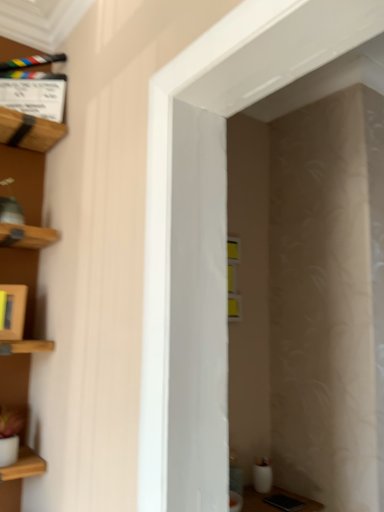
What do you see at coordinates (14, 311) in the screenshot? The width and height of the screenshot is (384, 512). I see `wooden frame at left` at bounding box center [14, 311].

You are a GUI agent. You are given a task and a screenshot of the screen. Output one action in this format:
    pyautogui.click(x=<x>, y=<y>)
    Task: Click on the wooden frame at left
    The image size is (384, 512).
    Given the screenshot: What is the action you would take?
    pyautogui.click(x=14, y=311)

Describe the element at coordinates (198, 314) in the screenshot. I see `white glossy door at center` at that location.

You are a GUI agent. You are given a task and a screenshot of the screen. Output one action in this format:
    pyautogui.click(x=<x>, y=<y>)
    Task: Click on the wooden frame at left
    
    Given the screenshot: What is the action you would take?
    pyautogui.click(x=14, y=311)

From the image's perspective, is wooden frame at left on top of wooden clapperboard at upper left?

No, from the image's perspective, wooden frame at left is not over wooden clapperboard at upper left.

Would you say wooden frame at left is inside or outside wooden clapperboard at upper left?

wooden frame at left is outside wooden clapperboard at upper left.

Does point (16, 298) lie in front of point (42, 126)?

Yes.

Is wooden frame at left further to the viewer compared to wooden clapperboard at upper left?

No, it is in front of wooden clapperboard at upper left.

Is wooden clapperboard at upper left bigger than white glossy door at center?

Incorrect, wooden clapperboard at upper left is not larger than white glossy door at center.

Is wooden clapperboard at upper left in contact with white glossy door at center?

wooden clapperboard at upper left and white glossy door at center are not in contact.

Which of these two, wooden clapperboard at upper left or white glossy door at center, is thinner?

With smaller width is wooden clapperboard at upper left.

Does point (218, 330) come closer to viewer compared to point (57, 54)?

Yes, it is.

Considering the relative sizes of white glossy door at center and wooden clapperboard at upper left in the image provided, is white glossy door at center smaller than wooden clapperboard at upper left?

Incorrect, white glossy door at center is not smaller in size than wooden clapperboard at upper left.

Could you tell me if white glossy door at center is turned towards wooden clapperboard at upper left?

No, white glossy door at center does not turn towards wooden clapperboard at upper left.

Is white glossy door at center in front of or behind wooden clapperboard at upper left in the image?

white glossy door at center is in front of wooden clapperboard at upper left.

Is wooden frame at left turned away from white glossy door at center?

No.

Where is `cabinet located on the left of white glossy door at center`? cabinet located on the left of white glossy door at center is located at coordinates (14, 311).

Consider the image. Considering the relative positions of wooden frame at left and white glossy door at center in the image provided, is wooden frame at left to the left or to the right of white glossy door at center?

wooden frame at left is to the left of white glossy door at center.

Looking at their sizes, would you say wooden frame at left is wider or thinner than white glossy door at center?

wooden frame at left is thinner than white glossy door at center.

From the image's perspective, which object appears higher, white glossy door at center or wooden frame at left?

From the image's view, white glossy door at center is above.

Identify the location of cabinet below the white glossy door at center (from the image's perspective). (14, 311).

Who is shorter, white glossy door at center or wooden frame at left?

wooden frame at left.

From a real-world perspective, relative to wooden frame at left, is white glossy door at center vertically above or below?

white glossy door at center is situated higher than wooden frame at left in the real world.

Are wooden clapperboard at upper left and wooden frame at left beside each other?

wooden clapperboard at upper left and wooden frame at left are not in contact.

Between wooden clapperboard at upper left and wooden frame at left, which one has more height?

wooden clapperboard at upper left is taller.

Does wooden clapperboard at upper left have a greater width compared to wooden frame at left?

Yes, wooden clapperboard at upper left is wider than wooden frame at left.

Which object is further away from the camera taking this photo, wooden clapperboard at upper left or wooden frame at left?

wooden clapperboard at upper left is behind.

Find the location of `cabinet on the left of wooden clapperboard at upper left`. cabinet on the left of wooden clapperboard at upper left is located at coordinates (14, 311).

What are the coordinates of `shelf above the white glossy door at center (from a real-world perspective)` in the screenshot? It's located at (30, 100).

Looking at the image, which one is located closer to wooden clapperboard at upper left, wooden frame at left or white glossy door at center?

wooden frame at left is closer to wooden clapperboard at upper left.

Considering their positions, is white glossy door at center positioned closer to wooden clapperboard at upper left than wooden frame at left?

Based on the image, wooden frame at left appears to be nearer to wooden clapperboard at upper left.

Estimate the real-world distances between objects in this image. Which object is further from white glossy door at center, wooden clapperboard at upper left or wooden frame at left?

wooden clapperboard at upper left is further to white glossy door at center.

Based on their spatial positions, is wooden frame at left or wooden clapperboard at upper left closer to white glossy door at center?

Among the two, wooden frame at left is located nearer to white glossy door at center.

Which object lies further to the anchor point wooden frame at left, wooden clapperboard at upper left or white glossy door at center?

Based on the image, white glossy door at center appears to be further to wooden frame at left.

In the scene shown: When comparing their distances from wooden frame at left, does white glossy door at center or wooden clapperboard at upper left seem further?

Among the two, white glossy door at center is located further to wooden frame at left.

At what (x,y) coordinates should I click in order to perform the action: click on door between wooden clapperboard at upper left and wooden frame at left vertically. Please return your answer as a coordinate pair (x, y). Looking at the image, I should click on (198, 314).